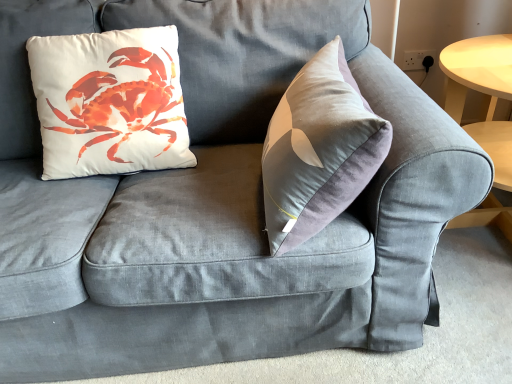
What do you see at coordinates (110, 102) in the screenshot? The width and height of the screenshot is (512, 384). I see `white matte cushion at upper left` at bounding box center [110, 102].

What are the coordinates of `white matte cushion at upper left` in the screenshot? It's located at (110, 102).

What is the approximate width of white matte cushion at upper left?

white matte cushion at upper left is 10.42 inches in width.

I want to click on white matte cushion at upper left, so click(x=110, y=102).